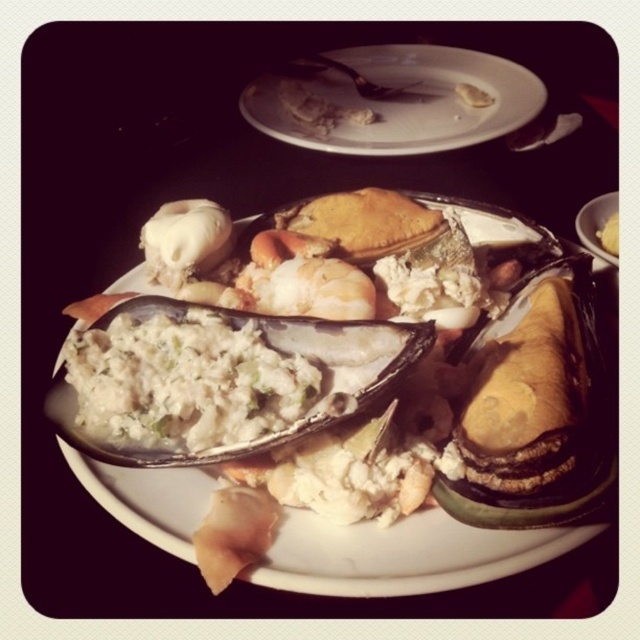
You are a chef arranging a display in a restaurant. You need to place a decorative garnish on the white porcelain plate at upper center. According to the coordinates provided, where should you place the garnish relative to the plate?

The white porcelain plate at upper center is located at point coordinates (406, 100), so you should place the garnish at those coordinates relative to the plate.

You are a food critic reviewing this dish. You notice the white porcelain plate at upper center and the yellow matte bread at center. Which object is positioned higher in the image?

The white porcelain plate at upper center is located above the yellow matte bread at center, so it is positioned higher in the image.